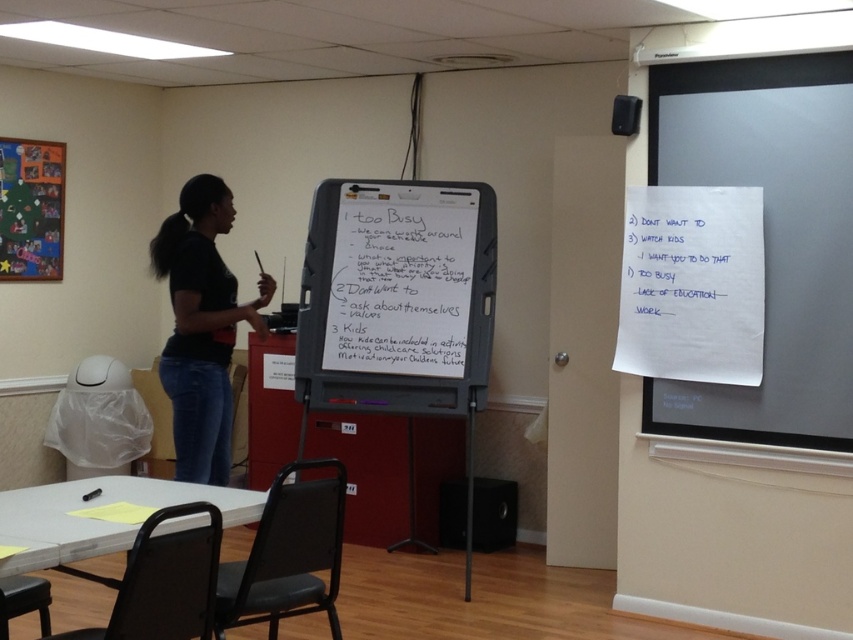
Who is shorter, white matte dry erase board at center or white paper at upper right?

Standing shorter between the two is white paper at upper right.

Does white matte dry erase board at center have a greater width compared to white paper at upper right?

Indeed, white matte dry erase board at center has a greater width compared to white paper at upper right.

Image resolution: width=853 pixels, height=640 pixels. Describe the element at coordinates (401, 282) in the screenshot. I see `white matte dry erase board at center` at that location.

You are a GUI agent. You are given a task and a screenshot of the screen. Output one action in this format:
    pyautogui.click(x=<x>, y=<y>)
    Task: Click on the white matte dry erase board at center
    
    Given the screenshot: What is the action you would take?
    pyautogui.click(x=401, y=282)

Which is in front, point (315, 387) or point (640, 192)?

Point (640, 192) is more forward.

Is whiteboard at center smaller than white paper at upper right?

Incorrect, whiteboard at center is not smaller in size than white paper at upper right.

Is point (491, 289) closer to viewer compared to point (624, 316)?

No, (491, 289) is further to viewer.

What are the coordinates of `whiteboard at center` in the screenshot? It's located at (397, 296).

Is white matte dry erase board at center above black matte shirt at center?

Yes, white matte dry erase board at center is above black matte shirt at center.

Which of these two, white matte dry erase board at center or black matte shirt at center, stands shorter?

white matte dry erase board at center

Does point (399, 218) come behind point (180, 481)?

Yes, point (399, 218) is behind point (180, 481).

Where is `white matte dry erase board at center`? white matte dry erase board at center is located at coordinates (401, 282).